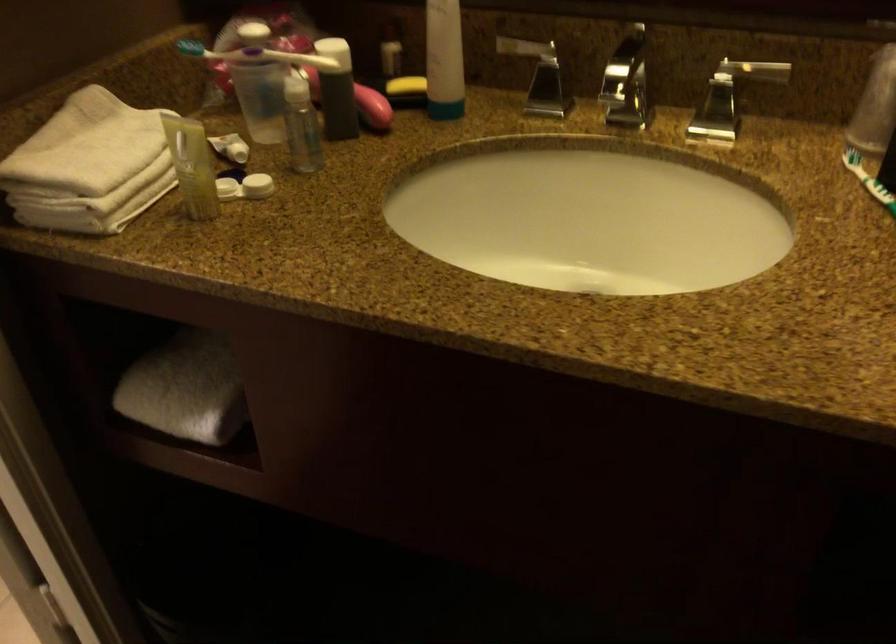
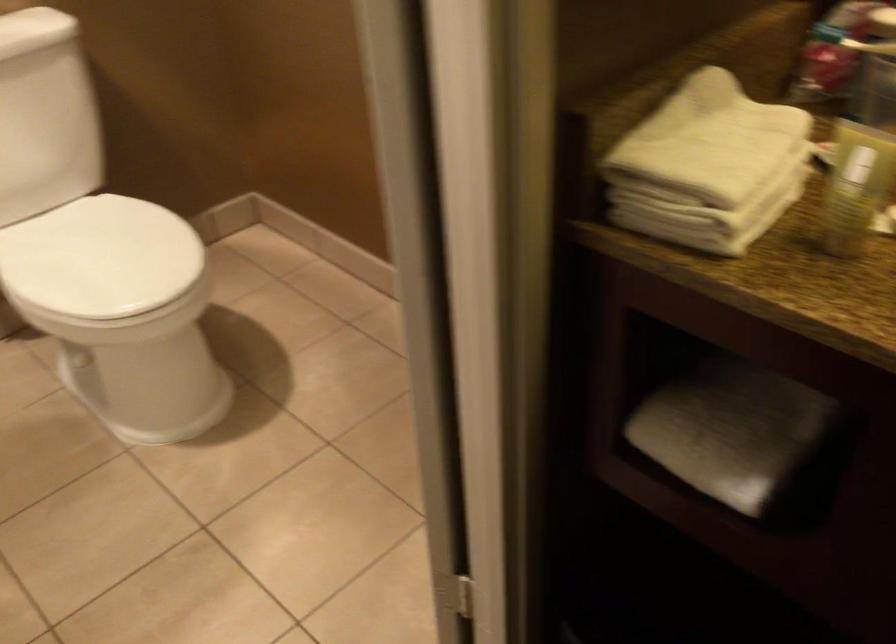
In the second image, find the point that corresponds to (190,381) in the first image.

(730, 431)